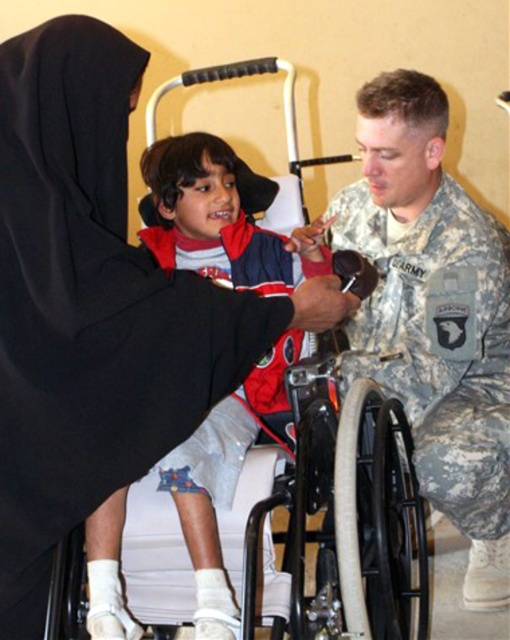
Question: Does camouflage uniform at right have a lesser width compared to white plastic wheelchair at center?

Choices:
 (A) yes
 (B) no

Answer: (B)

Question: Which point is closer to the camera?

Choices:
 (A) (110, 35)
 (B) (332, 470)

Answer: (A)

Question: Which object is farther from the camera taking this photo?

Choices:
 (A) white plastic wheelchair at center
 (B) camouflage uniform at right

Answer: (B)

Question: Which point is closer to the camera taking this photo?

Choices:
 (A) (2, 388)
 (B) (420, 451)
 (C) (394, 435)

Answer: (A)

Question: From the image, what is the correct spatial relationship of black fabric at upper left in relation to camouflage uniform at right?

Choices:
 (A) left
 (B) right

Answer: (A)

Question: Is the position of camouflage uniform at right more distant than that of white plastic wheelchair at center?

Choices:
 (A) yes
 (B) no

Answer: (A)